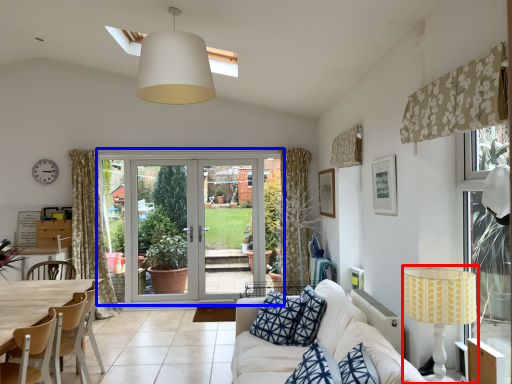
Question: Which object appears closest to the camera in this image, table lamp (highlighted by a red box) or door (highlighted by a blue box)?

Choices:
 (A) table lamp
 (B) door

Answer: (A)